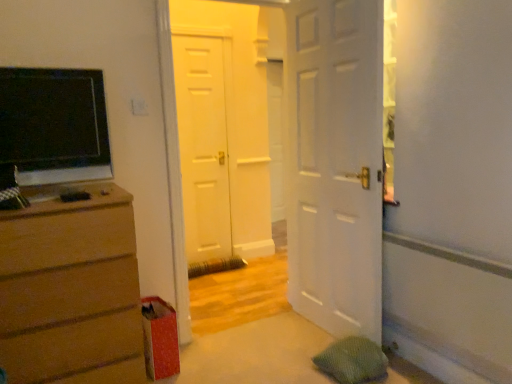
In order to click on vacant space that is to the left of white matte door at center, the 1th door in the front-to-back sequence in this screenshot , I will do `click(290, 340)`.